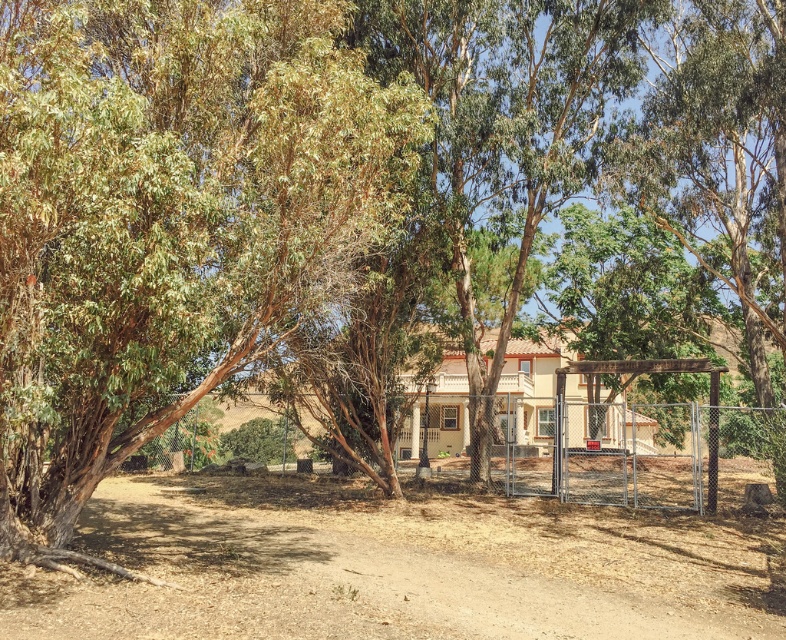
Is brown sandy dirt field at center below metallic chain-link fence at center-right?

Correct, brown sandy dirt field at center is located below metallic chain-link fence at center-right.

Between brown sandy dirt field at center and metallic chain-link fence at center-right, which one has less height?

With less height is brown sandy dirt field at center.

Between point (476, 572) and point (511, 451), which one is positioned in front?

Point (476, 572) is more forward.

At what (x,y) coordinates should I click in order to perform the action: click on brown sandy dirt field at center. Please return your answer as a coordinate pair (x, y). The height and width of the screenshot is (640, 786). Looking at the image, I should click on (399, 564).

Between green rough bark tree at left and metallic chain-link fence at center-right, which one has more height?

Standing taller between the two is green rough bark tree at left.

Is point (76, 92) more distant than point (680, 458)?

That is False.

Which is behind, point (248, 96) or point (715, 426)?

Positioned behind is point (715, 426).

Locate an element on the screen. Image resolution: width=786 pixels, height=640 pixels. green rough bark tree at left is located at coordinates (164, 218).

Is green rough bark tree at left to the right of brown sandy dirt field at center from the viewer's perspective?

In fact, green rough bark tree at left is to the left of brown sandy dirt field at center.

The width and height of the screenshot is (786, 640). Describe the element at coordinates (164, 218) in the screenshot. I see `green rough bark tree at left` at that location.

This screenshot has width=786, height=640. What are the coordinates of `green rough bark tree at left` in the screenshot? It's located at (164, 218).